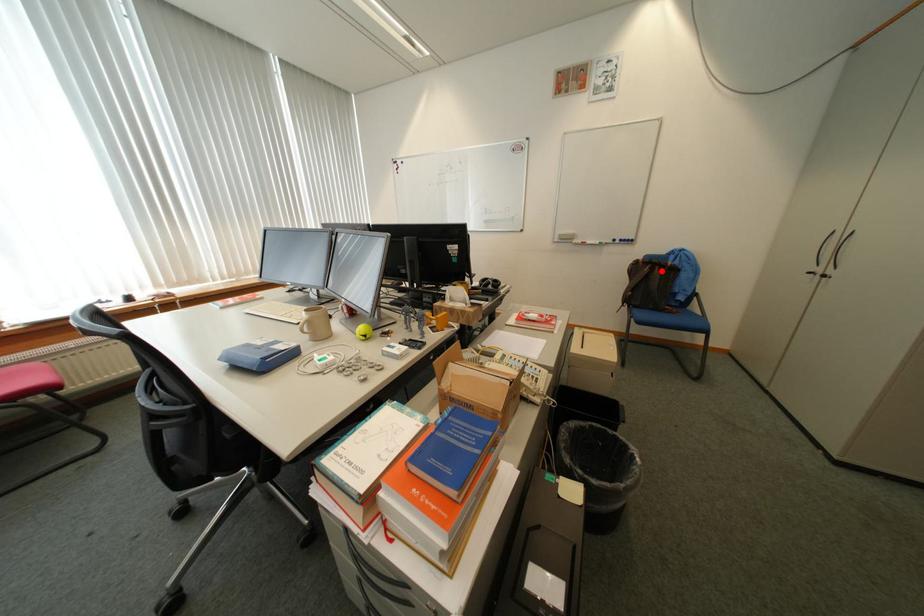
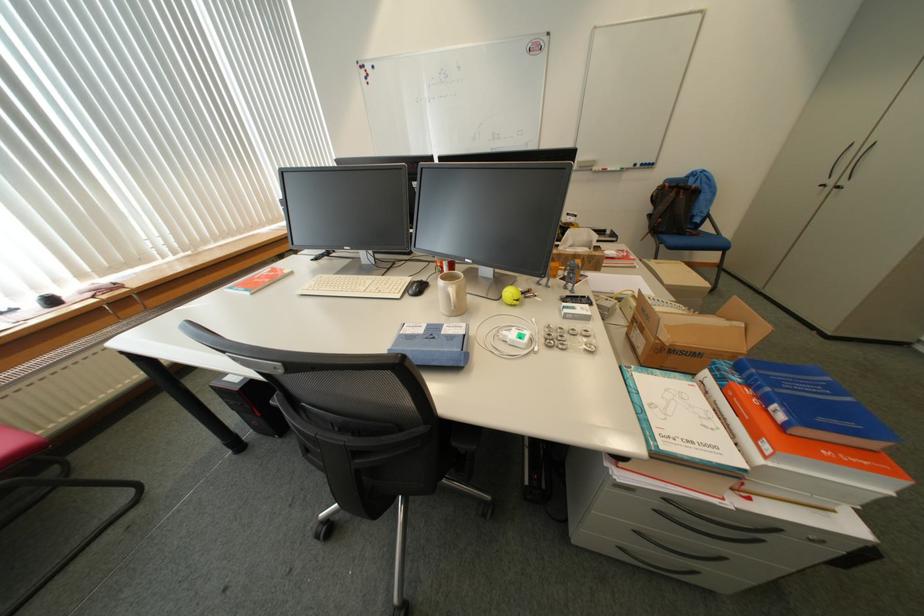
Where in the second image is the point corresponding to the highlighted location from the first image?

(687, 195)